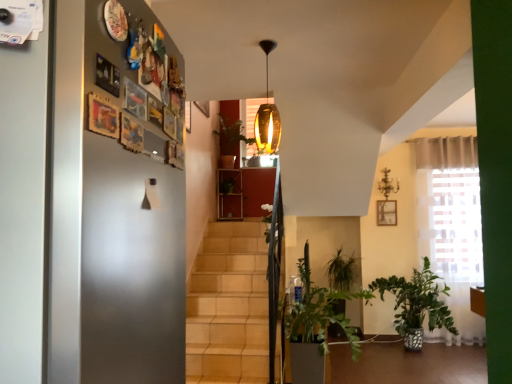
Identify the location of matte wooden picture frame at upper right. The width and height of the screenshot is (512, 384). (386, 212).

The width and height of the screenshot is (512, 384). Describe the element at coordinates (386, 212) in the screenshot. I see `matte wooden picture frame at upper right` at that location.

Image resolution: width=512 pixels, height=384 pixels. Identify the location of matte wooden picture frame at upper right. (386, 212).